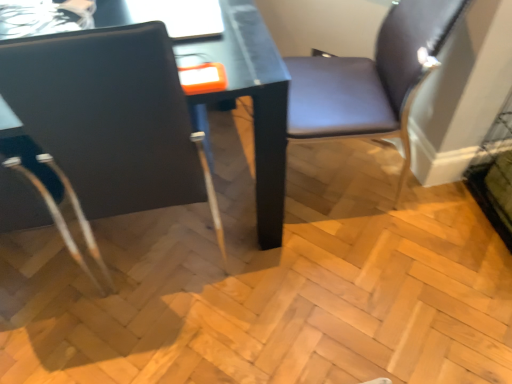
Question: Does purple leather chair at right, placed as the second chair when sorted from left to right, contain matte black chair at left, arranged as the 2th chair when viewed from the right?

Choices:
 (A) no
 (B) yes

Answer: (A)

Question: From the image's perspective, is purple leather chair at right, placed as the second chair when sorted from left to right, located beneath matte black chair at left, placed as the 1th chair when sorted from left to right?

Choices:
 (A) yes
 (B) no

Answer: (B)

Question: From the image's perspective, does purple leather chair at right, the first chair positioned from the right, appear higher than matte black chair at left, placed as the 1th chair when sorted from left to right?

Choices:
 (A) yes
 (B) no

Answer: (A)

Question: Is purple leather chair at right, placed as the second chair when sorted from left to right, with matte black chair at left, placed as the 1th chair when sorted from left to right?

Choices:
 (A) yes
 (B) no

Answer: (B)

Question: Considering the relative sizes of purple leather chair at right, the first chair positioned from the right, and matte black chair at left, arranged as the 2th chair when viewed from the right, in the image provided, is purple leather chair at right, the first chair positioned from the right, thinner than matte black chair at left, arranged as the 2th chair when viewed from the right,?

Choices:
 (A) yes
 (B) no

Answer: (A)

Question: Is purple leather chair at right, the first chair positioned from the right, at the right side of matte black chair at left, placed as the 1th chair when sorted from left to right?

Choices:
 (A) no
 (B) yes

Answer: (B)

Question: Can you confirm if matte black chair at left, placed as the 1th chair when sorted from left to right, is positioned to the left of purple leather chair at right, the first chair positioned from the right?

Choices:
 (A) no
 (B) yes

Answer: (B)

Question: Considering the relative positions of matte black chair at left, placed as the 1th chair when sorted from left to right, and purple leather chair at right, placed as the second chair when sorted from left to right, in the image provided, is matte black chair at left, placed as the 1th chair when sorted from left to right, to the right of purple leather chair at right, placed as the second chair when sorted from left to right, from the viewer's perspective?

Choices:
 (A) no
 (B) yes

Answer: (A)

Question: From a real-world perspective, is matte black chair at left, placed as the 1th chair when sorted from left to right, under purple leather chair at right, the first chair positioned from the right?

Choices:
 (A) yes
 (B) no

Answer: (B)

Question: Is matte black chair at left, arranged as the 2th chair when viewed from the right, thinner than purple leather chair at right, the first chair positioned from the right?

Choices:
 (A) yes
 (B) no

Answer: (B)

Question: From the image's perspective, is matte black chair at left, placed as the 1th chair when sorted from left to right, located beneath purple leather chair at right, the first chair positioned from the right?

Choices:
 (A) yes
 (B) no

Answer: (A)

Question: Can you confirm if matte black chair at left, arranged as the 2th chair when viewed from the right, is shorter than purple leather chair at right, the first chair positioned from the right?

Choices:
 (A) no
 (B) yes

Answer: (A)

Question: In terms of height, does purple leather chair at right, placed as the second chair when sorted from left to right, look taller or shorter compared to matte black chair at left, arranged as the 2th chair when viewed from the right?

Choices:
 (A) short
 (B) tall

Answer: (A)